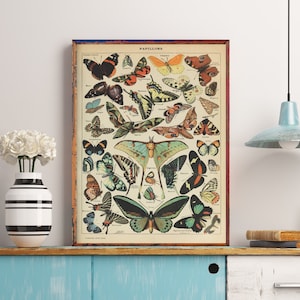
I want to click on white cabinet, so click(282, 277).